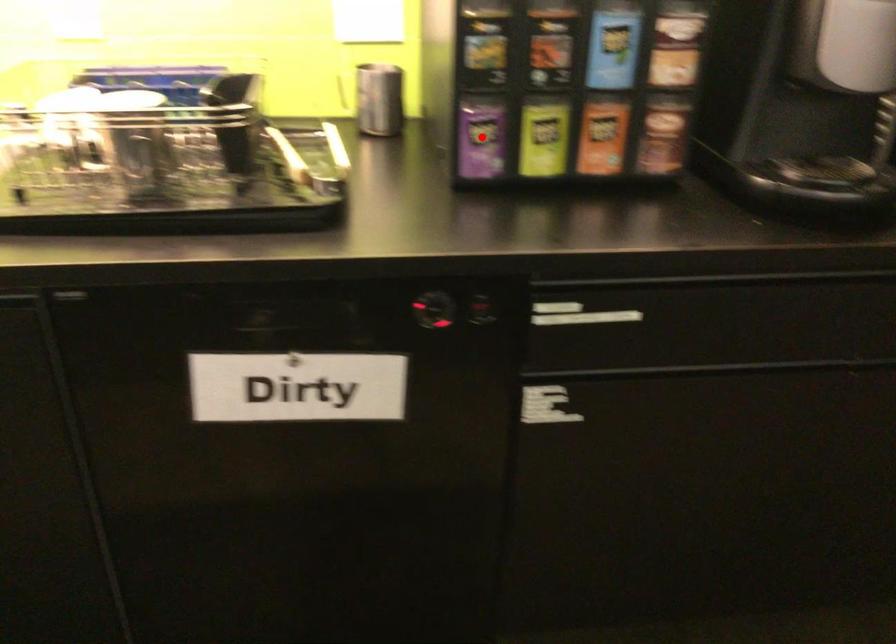
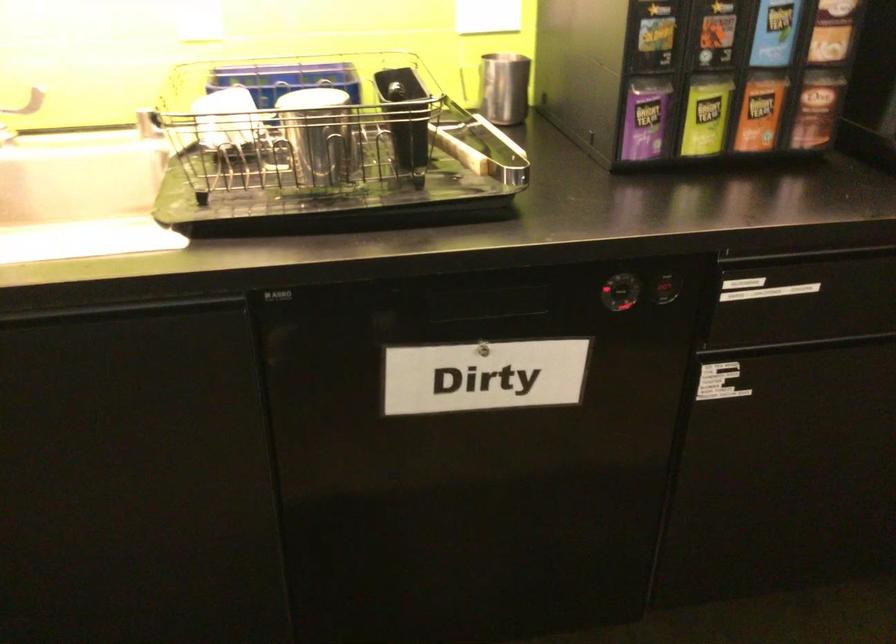
In the second image, find the point that corresponds to the highlighted location in the first image.

(645, 118)